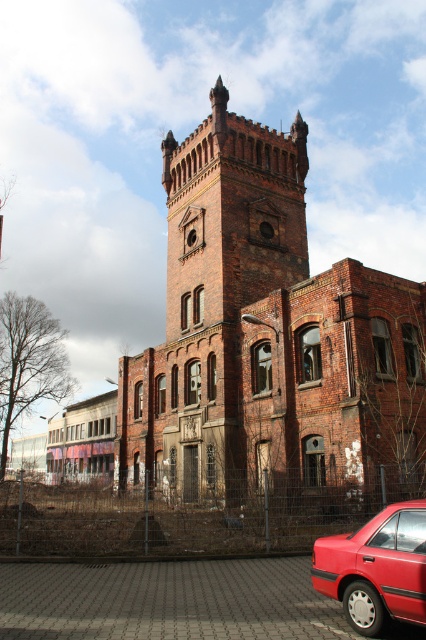
Question: Which of the following is the farthest from the observer?

Choices:
 (A) brown brick tower at center
 (B) shiny red sedan at lower right

Answer: (A)

Question: Estimate the real-world distances between objects in this image. Which object is farther from the rustic brick bell tower at center?

Choices:
 (A) shiny red sedan at lower right
 (B) brown brick tower at center

Answer: (A)

Question: Does brown brick tower at center have a larger size compared to rustic brick bell tower at center?

Choices:
 (A) yes
 (B) no

Answer: (A)

Question: Among these points, which one is farthest from the camera?

Choices:
 (A) (256, 189)
 (B) (423, 609)
 (C) (276, 285)

Answer: (A)

Question: Can you confirm if rustic brick bell tower at center is bigger than shiny red sedan at lower right?

Choices:
 (A) no
 (B) yes

Answer: (B)

Question: Does brown brick tower at center appear under rustic brick bell tower at center?

Choices:
 (A) no
 (B) yes

Answer: (B)